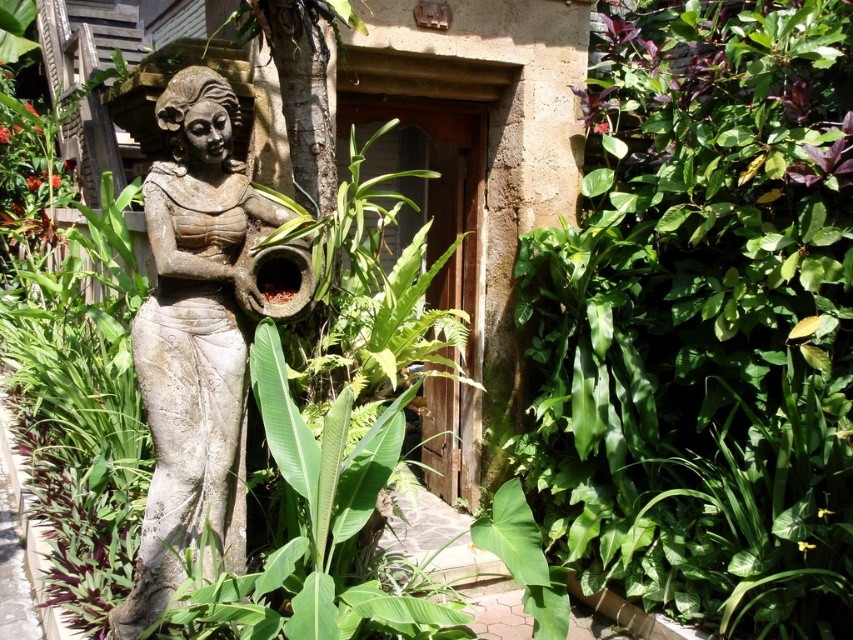
Question: Can you confirm if green leafy plant at center is positioned above stone statue at center?

Choices:
 (A) no
 (B) yes

Answer: (B)

Question: Is green leafy plant at center to the left of stone statue at center from the viewer's perspective?

Choices:
 (A) no
 (B) yes

Answer: (A)

Question: Which point is closer to the camera?

Choices:
 (A) green leafy plant at center
 (B) stone statue at center

Answer: (A)

Question: Which of the following is the closest to the observer?

Choices:
 (A) (175, 474)
 (B) (790, 74)

Answer: (A)

Question: From the image, what is the correct spatial relationship of green leafy plant at center in relation to stone statue at center?

Choices:
 (A) right
 (B) left

Answer: (A)